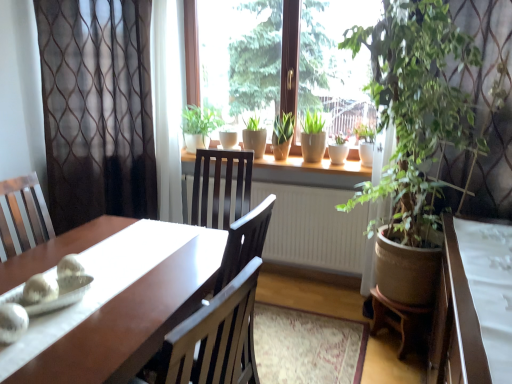
Identify the location of free spot above white textured radiator at center (from a real-world perspective). (306, 180).